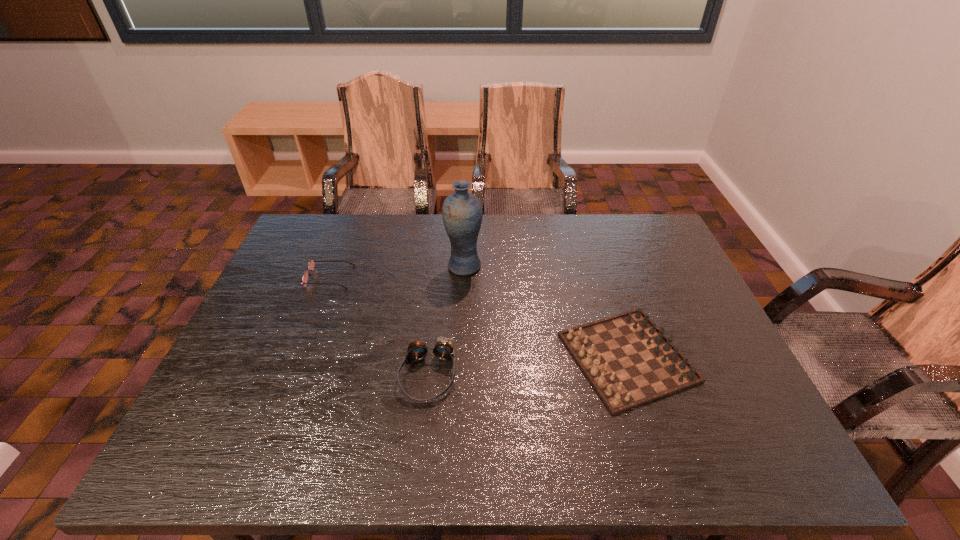
Where is `unoccupied position between the goggles and the shortest object`? Image resolution: width=960 pixels, height=540 pixels. unoccupied position between the goggles and the shortest object is located at coordinates (378, 326).

You are a GUI agent. You are given a task and a screenshot of the screen. Output one action in this format:
    pyautogui.click(x=<x>, y=<y>)
    Task: Click on the free space between the sunglasses and the goggles
    The image size is (960, 540).
    Given the screenshot: What is the action you would take?
    pyautogui.click(x=378, y=326)

I want to click on free spot between the tallest object and the goggles, so click(445, 321).

In order to click on blank region between the vase and the sunglasses in this screenshot , I will do `click(396, 272)`.

Locate an element on the screen. unoccupied area between the rightmost object and the goggles is located at coordinates (527, 366).

Find the location of a particular element. This screenshot has width=960, height=540. free spot between the vase and the shortest object is located at coordinates (396, 272).

The height and width of the screenshot is (540, 960). I want to click on unoccupied position between the sunglasses and the rightmost object, so click(478, 317).

Locate an element on the screen. The width and height of the screenshot is (960, 540). free area in between the goggles and the tallest object is located at coordinates (445, 321).

Point out which object is positioned as the second nearest to the rightmost object. Please provide its 2D coordinates. Your answer should be formatted as a tuple, i.e. [(x, y)], where the tuple contains the x and y coordinates of a point satisfying the conditions above.

[(443, 350)]

Choose which object is the nearest neighbor to the goggles. Please provide its 2D coordinates. Your answer should be formatted as a tuple, i.e. [(x, y)], where the tuple contains the x and y coordinates of a point satisfying the conditions above.

[(629, 361)]